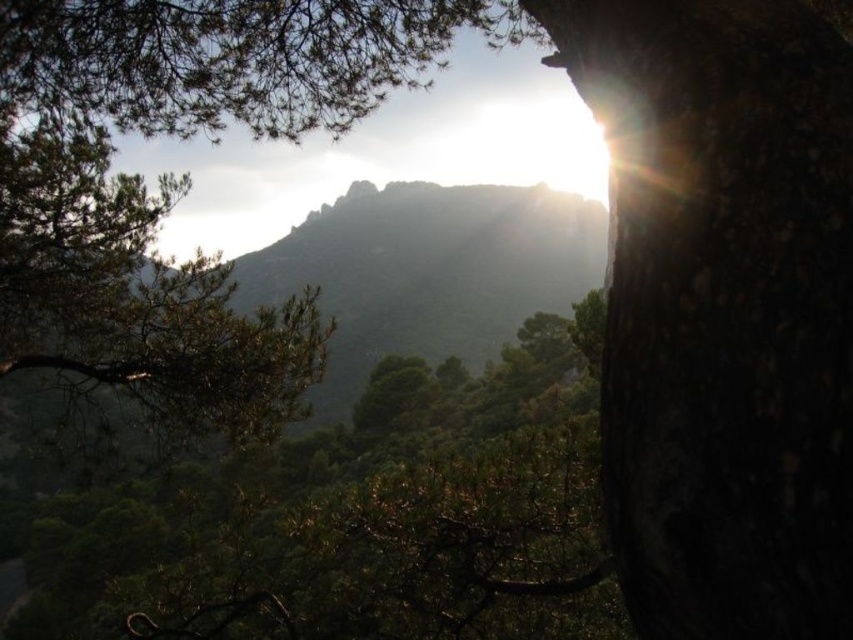
Is green needle-like leaves at left bigger than green textured tree at upper left?

Correct, green needle-like leaves at left is larger in size than green textured tree at upper left.

Does green needle-like leaves at left appear under green textured tree at upper left?

Correct, green needle-like leaves at left is located below green textured tree at upper left.

Find the location of a particular element. The height and width of the screenshot is (640, 853). green needle-like leaves at left is located at coordinates (136, 298).

I want to click on green needle-like leaves at left, so click(136, 298).

Does green needle-like leaves at left appear on the right side of green textured mountain at upper center?

Incorrect, green needle-like leaves at left is not on the right side of green textured mountain at upper center.

Does point (39, 173) come behind point (303, 266)?

No.

Locate an element on the screen. Image resolution: width=853 pixels, height=640 pixels. green needle-like leaves at left is located at coordinates (136, 298).

The image size is (853, 640). Find the location of `green needle-like leaves at left`. green needle-like leaves at left is located at coordinates (136, 298).

Is point (625, 628) behind point (200, 113)?

No, (625, 628) is in front of (200, 113).

Between point (593, 490) and point (422, 58), which one is positioned behind?

The point (422, 58) is behind.

The height and width of the screenshot is (640, 853). What are the coordinates of `green textured leaves at center` in the screenshot? It's located at (360, 518).